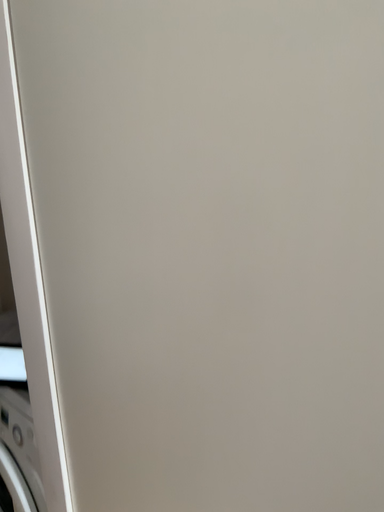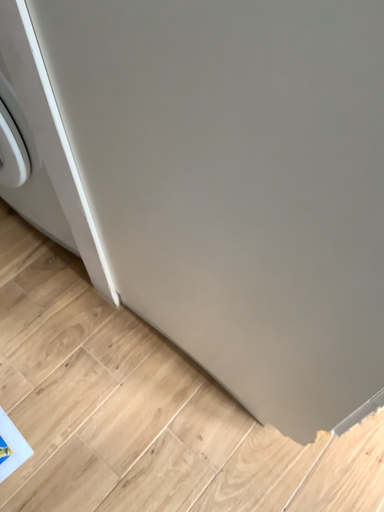
Question: How did the camera likely rotate when shooting the video?

Choices:
 (A) rotated upward
 (B) rotated downward

Answer: (B)